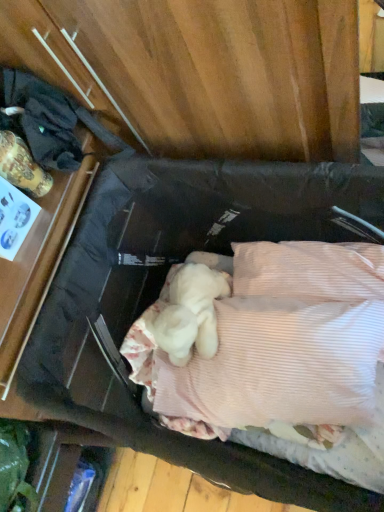
Question: Does matte black backpack at left have a lesser width compared to white soft blanket at center?

Choices:
 (A) no
 (B) yes

Answer: (B)

Question: Are matte black backpack at left and white soft blanket at center far apart?

Choices:
 (A) yes
 (B) no

Answer: (B)

Question: Can you confirm if matte black backpack at left is bigger than white soft blanket at center?

Choices:
 (A) no
 (B) yes

Answer: (A)

Question: From the image's perspective, is matte black backpack at left located above white soft blanket at center?

Choices:
 (A) no
 (B) yes

Answer: (B)

Question: Can you confirm if matte black backpack at left is wider than white soft blanket at center?

Choices:
 (A) no
 (B) yes

Answer: (A)

Question: Does matte black backpack at left contain white soft blanket at center?

Choices:
 (A) yes
 (B) no

Answer: (B)

Question: Does white soft blanket at center lie behind matte black backpack at left?

Choices:
 (A) no
 (B) yes

Answer: (B)

Question: Considering the relative sizes of white soft blanket at center and matte black backpack at left in the image provided, is white soft blanket at center smaller than matte black backpack at left?

Choices:
 (A) yes
 (B) no

Answer: (B)

Question: Is white soft blanket at center at the left side of matte black backpack at left?

Choices:
 (A) no
 (B) yes

Answer: (A)

Question: Is white soft blanket at center positioned beyond the bounds of matte black backpack at left?

Choices:
 (A) no
 (B) yes

Answer: (B)

Question: Is white soft blanket at center far from matte black backpack at left?

Choices:
 (A) no
 (B) yes

Answer: (A)

Question: Does white soft blanket at center have a lesser width compared to matte black backpack at left?

Choices:
 (A) no
 (B) yes

Answer: (A)

Question: Is point (332, 410) positioned closer to the camera than point (122, 147)?

Choices:
 (A) farther
 (B) closer

Answer: (B)